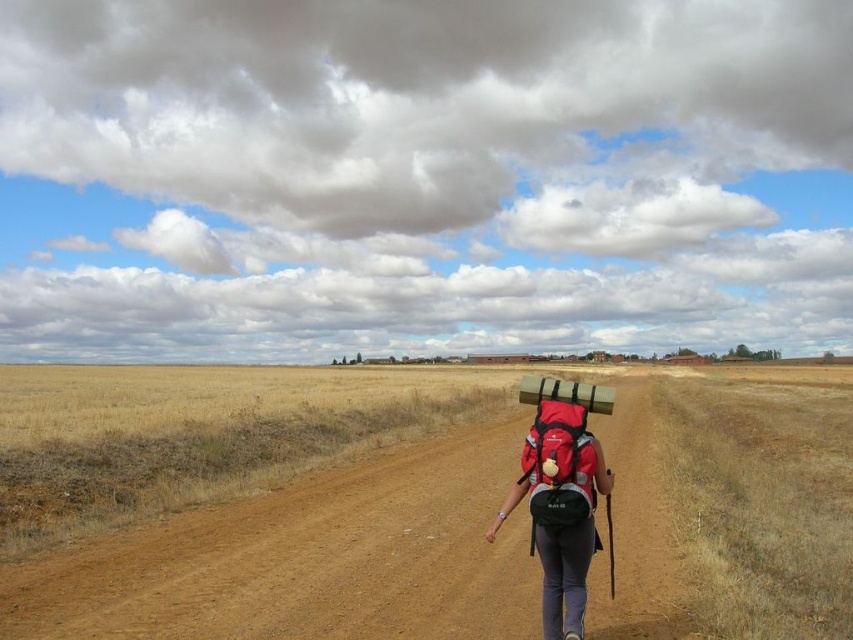
You are a hiker who just took a photo of yourself on the path. Looking at the image, you notice two backpacks labeled as red matte backpack at center and matte red backpack at center. Which backpack is closer to you in the photo?

The red matte backpack at center is closer to the viewer than the matte red backpack at center according to the description.

You are planning to place a red matte backpack at center on the brown dirt track at center. Based on the scene description, will the backpack fit entirely on the track?

The brown dirt track at center is bigger than red matte backpack at center, so yes, the backpack will fit entirely on the track.

From the picture: You are a hiker who just started the trail and see the red matte backpack at center and the matte red backpack at center. Which one is closer to the ground?

The red matte backpack at center is closer to the ground because it is positioned below the matte red backpack at center.